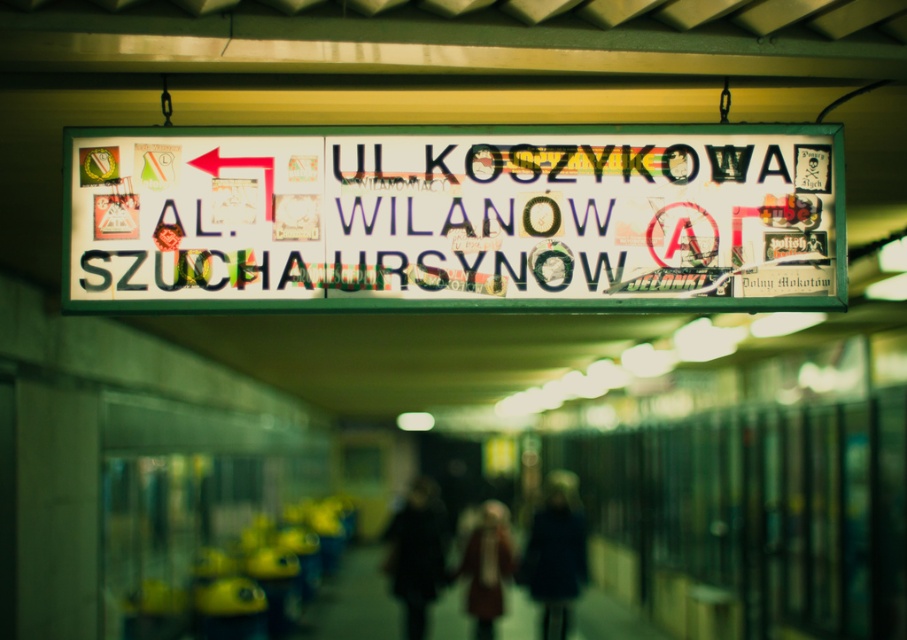
Between dark brown leather coat at center and red wool coat at center, which one is positioned higher?

dark brown leather coat at center

Does dark brown leather coat at center have a larger size compared to red wool coat at center?

No.

Who is more forward, [405,572] or [476,552]?

Point [405,572] is in front.

I want to click on dark brown leather coat at center, so click(416, 554).

Can you confirm if white paper sign at center is smaller than red wool coat at center?

Incorrect, white paper sign at center is not smaller in size than red wool coat at center.

Who is more distant from viewer, (517, 140) or (504, 520)?

Point (504, 520)

At what (x,y) coordinates should I click in order to perform the action: click on white paper sign at center. Please return your answer as a coordinate pair (x, y). The height and width of the screenshot is (640, 907). Looking at the image, I should click on (456, 218).

This screenshot has width=907, height=640. Describe the element at coordinates (456, 218) in the screenshot. I see `white paper sign at center` at that location.

Who is taller, white paper sign at center or dark blue coat at center?

With more height is dark blue coat at center.

Between point (788, 166) and point (550, 608), which one is positioned in front?

Point (788, 166) is more forward.

The width and height of the screenshot is (907, 640). Identify the location of white paper sign at center. (456, 218).